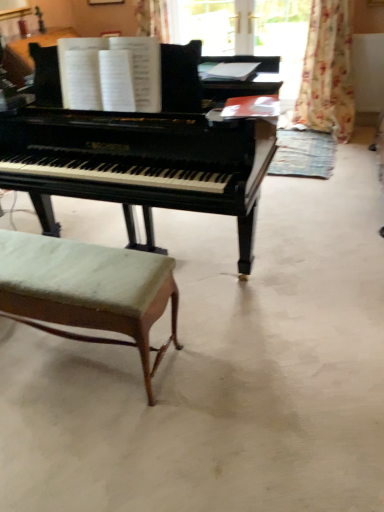
This screenshot has height=512, width=384. In order to click on green fabric stool at lower left in this screenshot , I will do `click(88, 290)`.

What do you see at coordinates (137, 154) in the screenshot?
I see `black polished piano at center` at bounding box center [137, 154].

This screenshot has height=512, width=384. I want to click on floral fabric curtain at upper right, so click(x=327, y=72).

Identify the location of green fabric stool at lower left. Image resolution: width=384 pixels, height=512 pixels. (88, 290).

Could you tell me if floral fabric curtain at upper right is turned towards black piano at center?

No, floral fabric curtain at upper right is not turned towards black piano at center.

How much distance is there between floral fabric curtain at upper right and black piano at center?

floral fabric curtain at upper right is 8.05 feet away from black piano at center.

In the scene shown: Is floral fabric curtain at upper right positioned in front of black piano at center?

No, it is not.

Is floral fabric curtain at upper right at the right side of black piano at center?

Indeed, floral fabric curtain at upper right is positioned on the right side of black piano at center.

What's the angular difference between black polished piano at center and black piano at center's facing directions?

black polished piano at center and black piano at center are facing 1.83 degrees away from each other.

Between black polished piano at center and black piano at center, which one has smaller size?

black piano at center is smaller.

At what (x,y) coordinates should I click in order to perform the action: click on concrete lying in front of the black polished piano at center. Please return your answer as a coordinate pair (x, y). Looking at the image, I should click on (222, 372).

Which of these two, black polished piano at center or black piano at center, is wider?

With larger width is black piano at center.

From a real-world perspective, between green fabric stool at lower left and floral fabric curtain at upper right, who is vertically lower?

green fabric stool at lower left, from a real-world perspective.

Is green fabric stool at lower left at the left side of floral fabric curtain at upper right?

Yes, green fabric stool at lower left is to the left of floral fabric curtain at upper right.

Between green fabric stool at lower left and floral fabric curtain at upper right, which one has larger size?

With larger size is floral fabric curtain at upper right.

Considering the sizes of green fabric stool at lower left and floral fabric curtain at upper right in the image, is green fabric stool at lower left wider or thinner than floral fabric curtain at upper right?

green fabric stool at lower left is thinner than floral fabric curtain at upper right.

Considering the sizes of objects floral fabric curtain at upper right and black polished piano at center in the image provided, who is wider, floral fabric curtain at upper right or black polished piano at center?

With larger width is black polished piano at center.

Can you tell me how much floral fabric curtain at upper right and black polished piano at center differ in facing direction?

They differ by 0.601 degrees in their facing directions.

In the image, there is a floral fabric curtain at upper right. Identify the location of piano below it (from the image's perspective). This screenshot has width=384, height=512. (137, 154).

Which object is positioned more to the left, floral fabric curtain at upper right or black polished piano at center?

black polished piano at center.

Identify the location of piano that is above the green fabric stool at lower left (from a real-world perspective). (137, 154).

Is black polished piano at center turned away from green fabric stool at lower left?

black polished piano at center is not turned away from green fabric stool at lower left.

Is black polished piano at center not within green fabric stool at lower left?

Indeed, black polished piano at center is completely outside green fabric stool at lower left.

Relative to floral fabric curtain at upper right, is black piano at center in front or behind?

Visually, black piano at center is located in front of floral fabric curtain at upper right.

Is black piano at center not near floral fabric curtain at upper right?

Indeed, black piano at center is not near floral fabric curtain at upper right.

Which object is thinner, black piano at center or floral fabric curtain at upper right?

floral fabric curtain at upper right is thinner.

In the scene shown: Is black polished piano at center inside or outside of floral fabric curtain at upper right?

black polished piano at center is not inside floral fabric curtain at upper right, it's outside.

Which of these two, black polished piano at center or floral fabric curtain at upper right, is bigger?

Bigger between the two is black polished piano at center.

From a real-world perspective, is black polished piano at center physically located above or below floral fabric curtain at upper right?

In terms of real-world spatial position, black polished piano at center is above floral fabric curtain at upper right.

The width and height of the screenshot is (384, 512). I want to click on curtain on the right of black piano at center, so click(327, 72).

This screenshot has width=384, height=512. Find the location of `concrete below the black polished piano at center (from a real-world perspective)`. concrete below the black polished piano at center (from a real-world perspective) is located at coordinates (222, 372).

Based on their spatial positions, is black piano at center or green fabric stool at lower left closer to black polished piano at center?

green fabric stool at lower left.

Which object lies nearer to the anchor point floral fabric curtain at upper right, black polished piano at center or black piano at center?

The object closer to floral fabric curtain at upper right is black piano at center.

When comparing their distances from black polished piano at center, does green fabric stool at lower left or floral fabric curtain at upper right seem further?

floral fabric curtain at upper right is further to black polished piano at center.

From the image, which object appears to be farther from black polished piano at center, green fabric stool at lower left or black piano at center?

Based on the image, black piano at center appears to be further to black polished piano at center.

Which object lies further to the anchor point black piano at center, floral fabric curtain at upper right or green fabric stool at lower left?

floral fabric curtain at upper right.

Estimate the real-world distances between objects in this image. Which object is further from black polished piano at center, black piano at center or floral fabric curtain at upper right?

Among the two, floral fabric curtain at upper right is located further to black polished piano at center.

From the image, which object appears to be nearer to floral fabric curtain at upper right, black piano at center or green fabric stool at lower left?

black piano at center lies closer to floral fabric curtain at upper right than the other object.

Which object lies further to the anchor point green fabric stool at lower left, black piano at center or black polished piano at center?

The object further to green fabric stool at lower left is black polished piano at center.

This screenshot has height=512, width=384. Find the location of `concrete between black polished piano at center and green fabric stool at lower left vertically`. concrete between black polished piano at center and green fabric stool at lower left vertically is located at coordinates (222, 372).

This screenshot has height=512, width=384. I want to click on stool between black piano at center and floral fabric curtain at upper right from front to back, so click(x=88, y=290).

Locate an element on the screen. This screenshot has height=512, width=384. stool located between black polished piano at center and floral fabric curtain at upper right in the depth direction is located at coordinates (88, 290).

You are a GUI agent. You are given a task and a screenshot of the screen. Output one action in this format:
    pyautogui.click(x=<x>, y=<y>)
    Task: Click on the piano positioned between black piano at center and floral fabric curtain at upper right from near to far
    Image resolution: width=384 pixels, height=512 pixels.
    Given the screenshot: What is the action you would take?
    pyautogui.click(x=137, y=154)